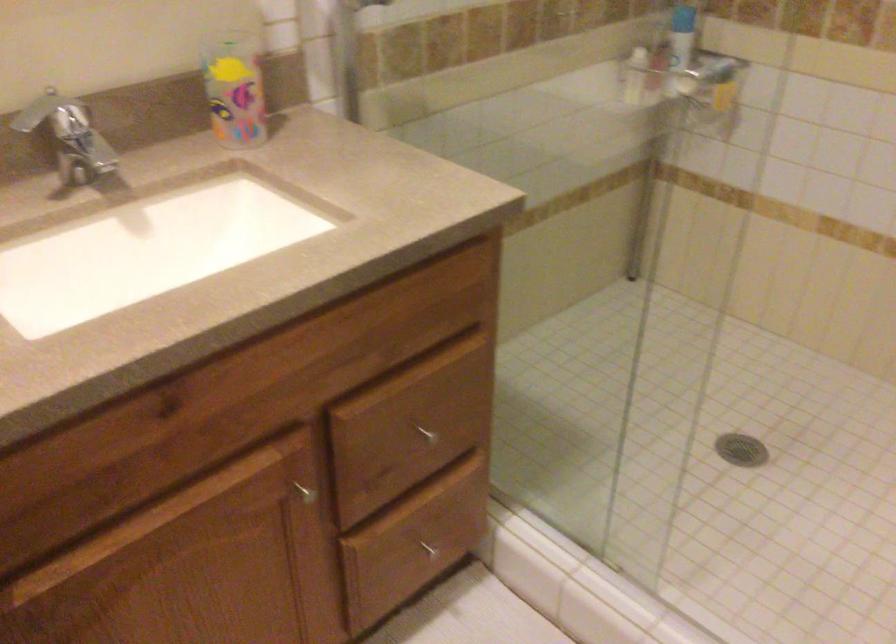
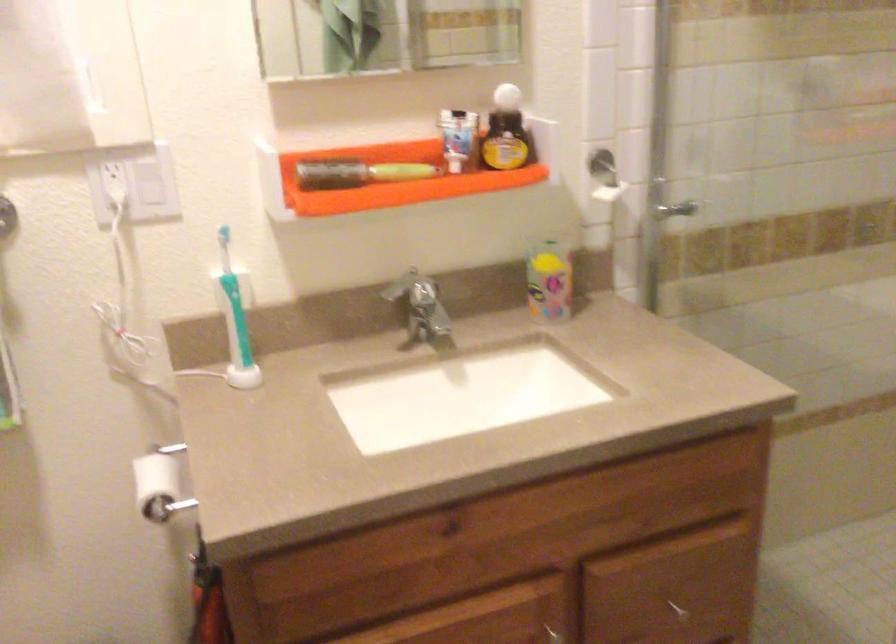
Find the pixel in the second image that matches point 235,93 in the first image.

(549, 279)